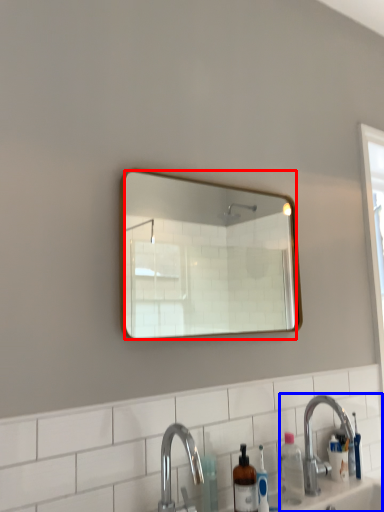
Question: Which object is further to the camera taking this photo, mirror (highlighted by a red box) or sink (highlighted by a blue box)?

Choices:
 (A) mirror
 (B) sink

Answer: (B)